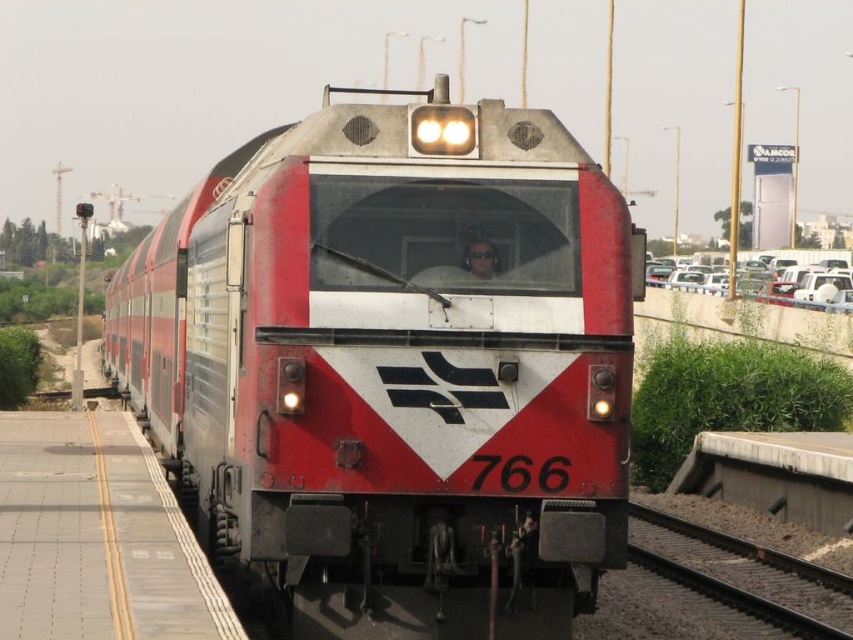
You are a passenger waiting at the gray concrete platform at lower left and want to board the metallic red train at center. Which direction should you walk to reach the train?

The metallic red train at center is positioned on the left side of the gray concrete platform at lower left, so you should walk to the left to reach the train.

You are a railway inspector checking the alignment of the metallic red train at center and the black metal train track at lower right. Based on the scene, which object is wider?

The metallic red train at center is wider than the black metal train track at lower right.